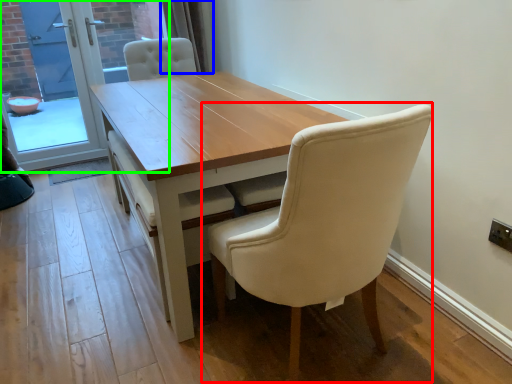
Question: Estimate the real-world distances between objects in this image. Which object is farther from chair (highlighted by a red box), curtain (highlighted by a blue box) or screen door (highlighted by a green box)?

Choices:
 (A) curtain
 (B) screen door

Answer: (B)